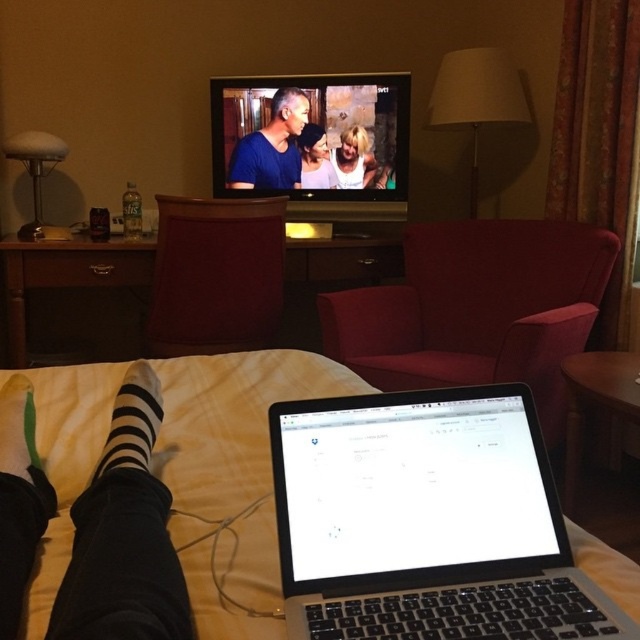
Can you confirm if matte red armchair at center is shorter than matte wood armchair at center?

No.

Describe the element at coordinates (477, 308) in the screenshot. I see `matte red armchair at center` at that location.

Is point (616, 253) positioned after point (259, 316)?

No, (616, 253) is in front of (259, 316).

You are a GUI agent. You are given a task and a screenshot of the screen. Output one action in this format:
    pyautogui.click(x=<x>, y=<y>)
    Task: Click on the matte red armchair at center
    This screenshot has height=640, width=640.
    Given the screenshot: What is the action you would take?
    pyautogui.click(x=477, y=308)

Does blue matte shirt at center have a larger size compared to black striped sock at lower left?

Yes, blue matte shirt at center is bigger than black striped sock at lower left.

Where is `blue matte shirt at center`? The width and height of the screenshot is (640, 640). blue matte shirt at center is located at coordinates pyautogui.click(x=272, y=147).

Is white striped socks at lower left smaller than matte white shirt at center?

No, white striped socks at lower left is not smaller than matte white shirt at center.

Is white striped socks at lower left shorter than matte white shirt at center?

Yes.

Is point (80, 528) farther from viewer compared to point (320, 125)?

No.

The image size is (640, 640). In order to click on white striped socks at lower left in this screenshot , I will do point(124,536).